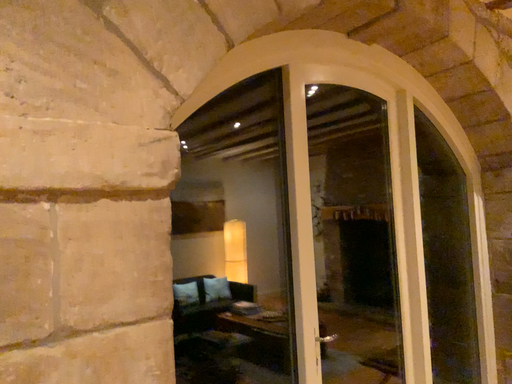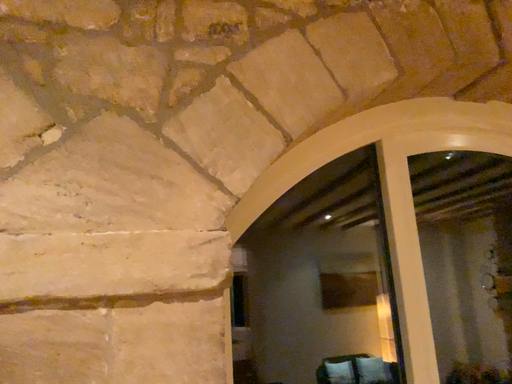
Question: Which way did the camera rotate in the video?

Choices:
 (A) rotated upward
 (B) rotated downward

Answer: (A)